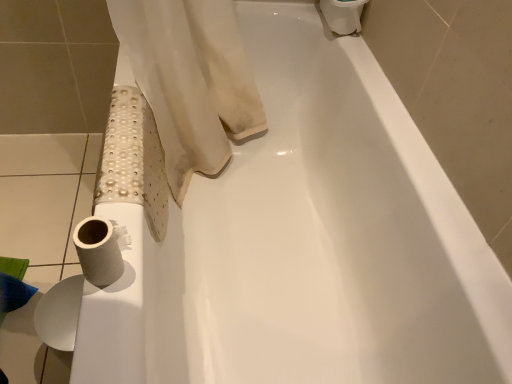
Locate an element on the screen. The width and height of the screenshot is (512, 384). white matte toilet paper at lower left, which is counted as the second toilet paper, starting from the right is located at coordinates (98, 251).

You are a GUI agent. You are given a task and a screenshot of the screen. Output one action in this format:
    pyautogui.click(x=<x>, y=<y>)
    Task: Click on the white matte toilet paper at lower left, the third toilet paper when ordered from top to bottom
    
    Given the screenshot: What is the action you would take?
    pyautogui.click(x=60, y=313)

From the image's perspective, is white matte toilet paper at lower left, the first toilet paper in the left-to-right sequence, under white matte toilet paper at upper right, placed as the third toilet paper when sorted from left to right?

Yes.

Which of these two, white matte toilet paper at lower left, arranged as the 2th toilet paper when viewed from the front, or white matte toilet paper at upper right, placed as the third toilet paper when sorted from left to right, is wider?

white matte toilet paper at upper right, placed as the third toilet paper when sorted from left to right.

Is white matte toilet paper at lower left, the 3th toilet paper in the right-to-left sequence, outside of white matte toilet paper at upper right, arranged as the third toilet paper when viewed from the front?

Yes.

Which is behind, white matte toilet paper at lower left, the first toilet paper in the left-to-right sequence, or white matte toilet paper at upper right, which is the first toilet paper from back to front?

white matte toilet paper at upper right, which is the first toilet paper from back to front, is further away from the camera.

Could you tell me if white matte toilet paper at lower left, the 3th toilet paper in the back-to-front sequence, is facing white matte toilet paper at lower left, the third toilet paper when ordered from top to bottom?

No, white matte toilet paper at lower left, the 3th toilet paper in the back-to-front sequence, is not aimed at white matte toilet paper at lower left, the third toilet paper when ordered from top to bottom.

Considering the relative sizes of white matte toilet paper at lower left, which is counted as the second toilet paper, starting from the right, and white matte toilet paper at lower left, the 3th toilet paper in the right-to-left sequence, in the image provided, is white matte toilet paper at lower left, which is counted as the second toilet paper, starting from the right, wider than white matte toilet paper at lower left, the 3th toilet paper in the right-to-left sequence,?

Yes, white matte toilet paper at lower left, which is counted as the second toilet paper, starting from the right, is wider than white matte toilet paper at lower left, the 3th toilet paper in the right-to-left sequence.

Is point (110, 267) positioned in front of point (46, 334)?

No, (110, 267) is further to viewer.

Is white matte toilet paper at lower left, which is the second toilet paper in top-to-bottom order, situated inside white matte toilet paper at upper right, arranged as the 3th toilet paper when ordered from the bottom, or outside?

white matte toilet paper at lower left, which is the second toilet paper in top-to-bottom order, is spatially situated outside white matte toilet paper at upper right, arranged as the 3th toilet paper when ordered from the bottom.

From a real-world perspective, between white matte toilet paper at lower left, the 3th toilet paper in the back-to-front sequence, and white matte toilet paper at upper right, which is the first toilet paper from back to front, who is vertically higher?

white matte toilet paper at upper right, which is the first toilet paper from back to front.

Is there a large distance between white matte toilet paper at lower left, the 3th toilet paper in the back-to-front sequence, and white matte toilet paper at upper right, which is the first toilet paper from back to front?

Absolutely, white matte toilet paper at lower left, the 3th toilet paper in the back-to-front sequence, is distant from white matte toilet paper at upper right, which is the first toilet paper from back to front.

Considering the points (360, 5) and (97, 251), which point is in front, point (360, 5) or point (97, 251)?

The point (97, 251) is more forward.

Does white matte toilet paper at upper right, which is counted as the first toilet paper, starting from the right, contain white matte toilet paper at lower left, the 3th toilet paper in the back-to-front sequence?

No, white matte toilet paper at lower left, the 3th toilet paper in the back-to-front sequence, is located outside of white matte toilet paper at upper right, which is counted as the first toilet paper, starting from the right.

What's the angular difference between white matte toilet paper at upper right, which is the first toilet paper from back to front, and white matte toilet paper at lower left, the 3th toilet paper in the back-to-front sequence,'s facing directions?

white matte toilet paper at upper right, which is the first toilet paper from back to front, and white matte toilet paper at lower left, the 3th toilet paper in the back-to-front sequence, are facing 0.000798 degrees away from each other.

Considering the sizes of objects white matte toilet paper at upper right, arranged as the third toilet paper when viewed from the front, and white matte toilet paper at lower left, marked as the 1th toilet paper in a front-to-back arrangement, in the image provided, who is wider, white matte toilet paper at upper right, arranged as the third toilet paper when viewed from the front, or white matte toilet paper at lower left, marked as the 1th toilet paper in a front-to-back arrangement,?

With larger width is white matte toilet paper at upper right, arranged as the third toilet paper when viewed from the front.

From the image's perspective, is white matte toilet paper at upper right, arranged as the 3th toilet paper when ordered from the bottom, beneath white matte toilet paper at lower left, the first toilet paper in the left-to-right sequence?

No, from the image's perspective, white matte toilet paper at upper right, arranged as the 3th toilet paper when ordered from the bottom, is not below white matte toilet paper at lower left, the first toilet paper in the left-to-right sequence.

Is white matte toilet paper at upper right, arranged as the 3th toilet paper when ordered from the bottom, taller than white matte toilet paper at lower left, the 2th toilet paper when ordered from back to front?

No.

Is white matte toilet paper at upper right, placed as the third toilet paper when sorted from left to right, oriented away from white matte toilet paper at lower left, acting as the first toilet paper starting from the bottom?

white matte toilet paper at upper right, placed as the third toilet paper when sorted from left to right, does not have its back to white matte toilet paper at lower left, acting as the first toilet paper starting from the bottom.

Is white matte toilet paper at lower left, the 3th toilet paper in the right-to-left sequence, oriented away from white matte toilet paper at lower left, the 3th toilet paper in the back-to-front sequence?

No, white matte toilet paper at lower left, the 3th toilet paper in the right-to-left sequence, is not facing the opposite direction of white matte toilet paper at lower left, the 3th toilet paper in the back-to-front sequence.

Consider the image. Does white matte toilet paper at lower left, acting as the first toilet paper starting from the bottom, have a smaller size compared to white matte toilet paper at lower left, acting as the 2th toilet paper starting from the bottom?

No, white matte toilet paper at lower left, acting as the first toilet paper starting from the bottom, is not smaller than white matte toilet paper at lower left, acting as the 2th toilet paper starting from the bottom.

From a real-world perspective, which object rests below the other?

white matte toilet paper at lower left, the third toilet paper when ordered from top to bottom.

Which is more to the right, white matte toilet paper at lower left, the 3th toilet paper in the right-to-left sequence, or white matte toilet paper at lower left, which is the second toilet paper in top-to-bottom order?

white matte toilet paper at lower left, which is the second toilet paper in top-to-bottom order.

From the image's perspective, starting from the white matte toilet paper at upper right, arranged as the third toilet paper when viewed from the front, which toilet paper is the 2nd one below? Please provide its 2D coordinates.

[(60, 313)]

Locate an element on the screen. Image resolution: width=512 pixels, height=384 pixels. toilet paper below the white matte toilet paper at lower left, the 3th toilet paper in the back-to-front sequence (from a real-world perspective) is located at coordinates (60, 313).

Which object lies further to the anchor point white matte toilet paper at lower left, which is the second toilet paper in top-to-bottom order, white matte toilet paper at lower left, arranged as the 2th toilet paper when viewed from the front, or white matte toilet paper at upper right, the 1th toilet paper viewed from the top?

white matte toilet paper at upper right, the 1th toilet paper viewed from the top, lies further to white matte toilet paper at lower left, which is the second toilet paper in top-to-bottom order, than the other object.

Looking at the image, which one is located closer to white matte toilet paper at lower left, acting as the first toilet paper starting from the bottom, white matte toilet paper at upper right, the 1th toilet paper viewed from the top, or white matte toilet paper at lower left, marked as the 1th toilet paper in a front-to-back arrangement?

The object closer to white matte toilet paper at lower left, acting as the first toilet paper starting from the bottom, is white matte toilet paper at lower left, marked as the 1th toilet paper in a front-to-back arrangement.

Based on their spatial positions, is white matte toilet paper at lower left, the 3th toilet paper in the right-to-left sequence, or white matte toilet paper at lower left, which is counted as the second toilet paper, starting from the left, further from white matte toilet paper at upper right, placed as the third toilet paper when sorted from left to right?

Based on the image, white matte toilet paper at lower left, the 3th toilet paper in the right-to-left sequence, appears to be further to white matte toilet paper at upper right, placed as the third toilet paper when sorted from left to right.

Based on the photo, which object lies nearer to the anchor point white matte toilet paper at lower left, the 2th toilet paper when ordered from back to front, white matte toilet paper at lower left, marked as the 1th toilet paper in a front-to-back arrangement, or white matte toilet paper at upper right, arranged as the third toilet paper when viewed from the front?

The object closer to white matte toilet paper at lower left, the 2th toilet paper when ordered from back to front, is white matte toilet paper at lower left, marked as the 1th toilet paper in a front-to-back arrangement.

Estimate the real-world distances between objects in this image. Which object is further from white matte toilet paper at upper right, arranged as the 3th toilet paper when ordered from the bottom, white matte toilet paper at lower left, which is counted as the second toilet paper, starting from the left, or white matte toilet paper at lower left, the 3th toilet paper in the right-to-left sequence?

white matte toilet paper at lower left, the 3th toilet paper in the right-to-left sequence, is further to white matte toilet paper at upper right, arranged as the 3th toilet paper when ordered from the bottom.

Based on their spatial positions, is white matte toilet paper at upper right, which is the first toilet paper from back to front, or white matte toilet paper at lower left, the first toilet paper in the left-to-right sequence, further from white matte toilet paper at lower left, marked as the 1th toilet paper in a front-to-back arrangement?

white matte toilet paper at upper right, which is the first toilet paper from back to front, is positioned further to the anchor white matte toilet paper at lower left, marked as the 1th toilet paper in a front-to-back arrangement.

Where is `toilet paper between white matte toilet paper at upper right, which is counted as the first toilet paper, starting from the right, and white matte toilet paper at lower left, the 3th toilet paper in the right-to-left sequence, vertically`? The width and height of the screenshot is (512, 384). toilet paper between white matte toilet paper at upper right, which is counted as the first toilet paper, starting from the right, and white matte toilet paper at lower left, the 3th toilet paper in the right-to-left sequence, vertically is located at coordinates (98, 251).